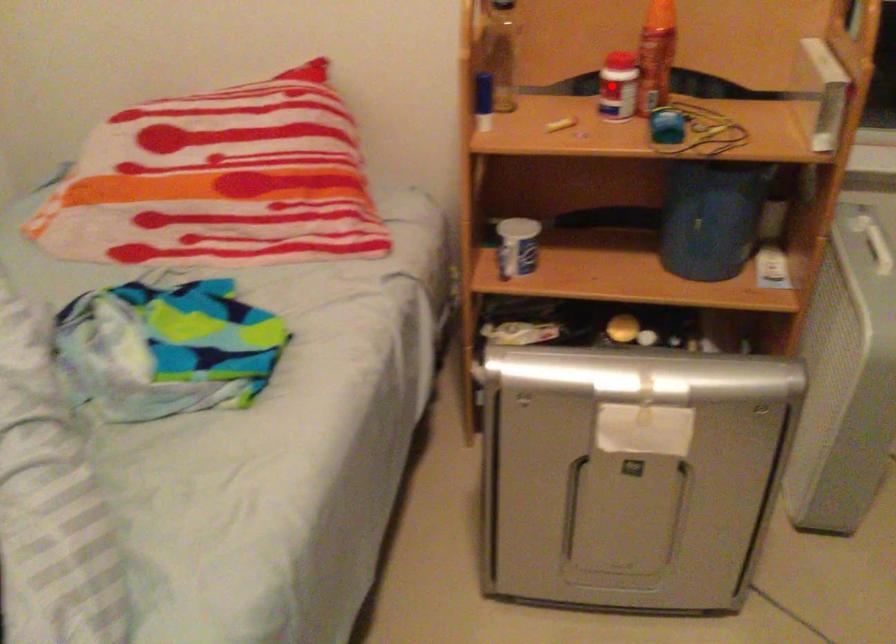
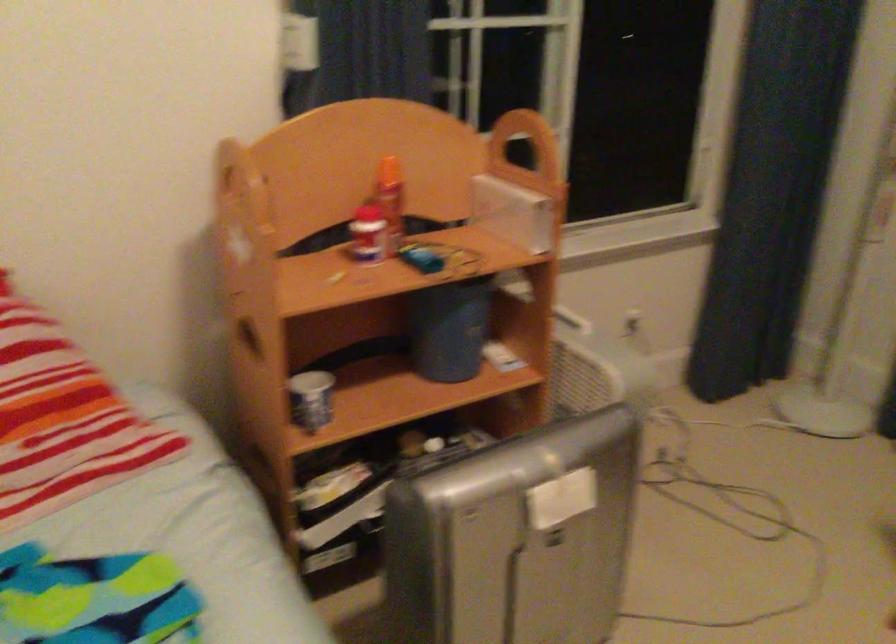
Question: I am providing you with two images of the same scene from different viewpoints. A red point is shown in image1. For the corresponding object point in image2, is it positioned nearer or farther from the camera?

Choices:
 (A) Nearer
 (B) Farther

Answer: (B)